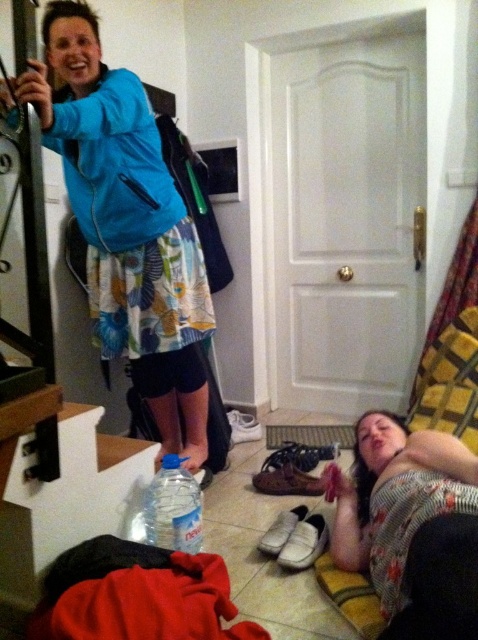
I want to click on blue matte jacket at upper left, so click(x=126, y=221).

Is point (167, 218) positioned before point (401, 630)?

That is False.

Is point (189, 470) closer to viewer compared to point (473, 588)?

No, it is not.

This screenshot has height=640, width=478. Find the location of `blue matte jacket at upper left`. blue matte jacket at upper left is located at coordinates (126, 221).

Can you confirm if floral fabric shirt at lower right is positioned to the right of clear plastic water bottle at lower center?

Indeed, floral fabric shirt at lower right is positioned on the right side of clear plastic water bottle at lower center.

Identify the location of floral fabric shirt at lower right. (410, 525).

Which is behind, point (386, 593) or point (188, 538)?

Positioned behind is point (188, 538).

Find the location of a particular element. floral fabric shirt at lower right is located at coordinates (410, 525).

Does blue matte jacket at upper left lie behind clear plastic water bottle at lower center?

No.

You are a GUI agent. You are given a task and a screenshot of the screen. Output one action in this format:
    pyautogui.click(x=<x>, y=<y>)
    Task: Click on the blue matte jacket at upper left
    
    Given the screenshot: What is the action you would take?
    pyautogui.click(x=126, y=221)

Identify the location of blue matte jacket at upper left. The width and height of the screenshot is (478, 640). (126, 221).